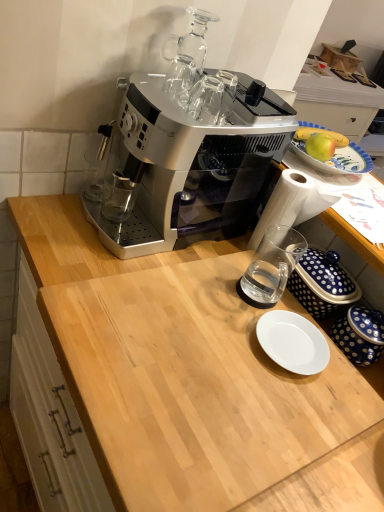
Identify the location of vacant space in light wood cutting board at center (from a real-world perspective). [206, 383].